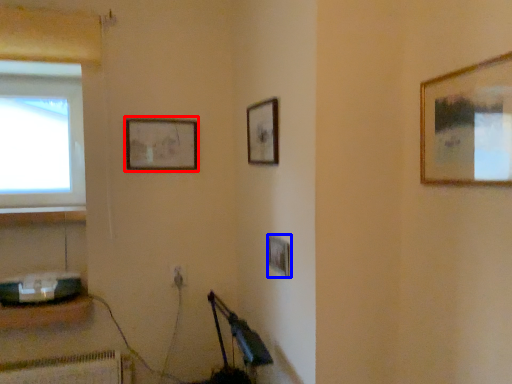
Question: Which of the following is the closest to the observer, picture frame (highlighted by a red box) or picture frame (highlighted by a blue box)?

Choices:
 (A) picture frame
 (B) picture frame

Answer: (B)